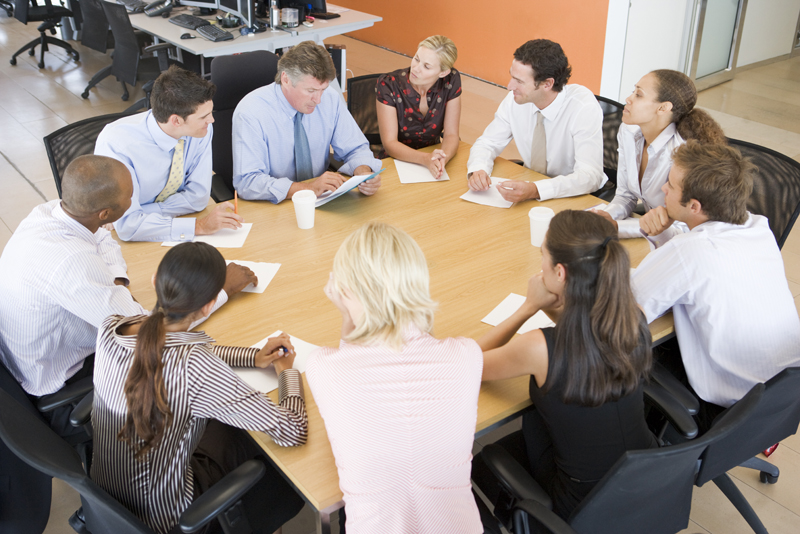
Find the location of a particular element. The height and width of the screenshot is (534, 800). work papers is located at coordinates (237, 235), (262, 269), (258, 373), (516, 299), (605, 205), (486, 199), (406, 171), (354, 184).